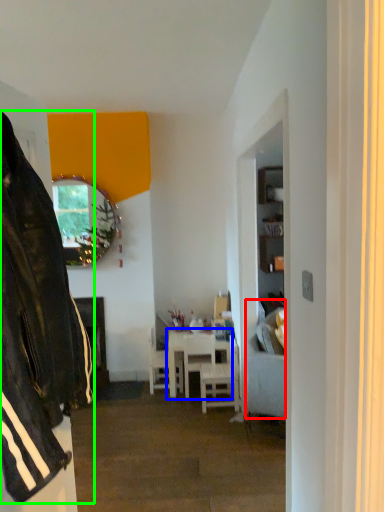
Question: Which is nearer to the studio couch (highlighted by a red box)? table (highlighted by a blue box) or leather jacket (highlighted by a green box).

Choices:
 (A) table
 (B) leather jacket

Answer: (A)